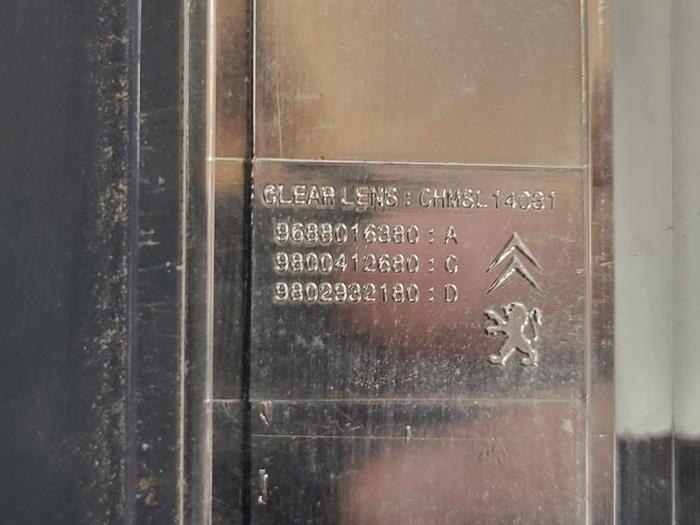
Locate an element on the screen. This screenshot has width=700, height=525. cracks on wall is located at coordinates (112, 427), (116, 332), (120, 188), (120, 66).